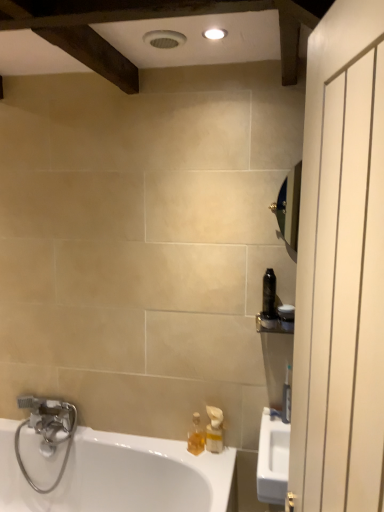
Find the location of a particular element. The width and height of the screenshot is (384, 512). vacant space situated on the left part of translucent plastic soap dispenser at lower center, placed as the first soap dispenser when sorted from right to left is located at coordinates pyautogui.click(x=183, y=453).